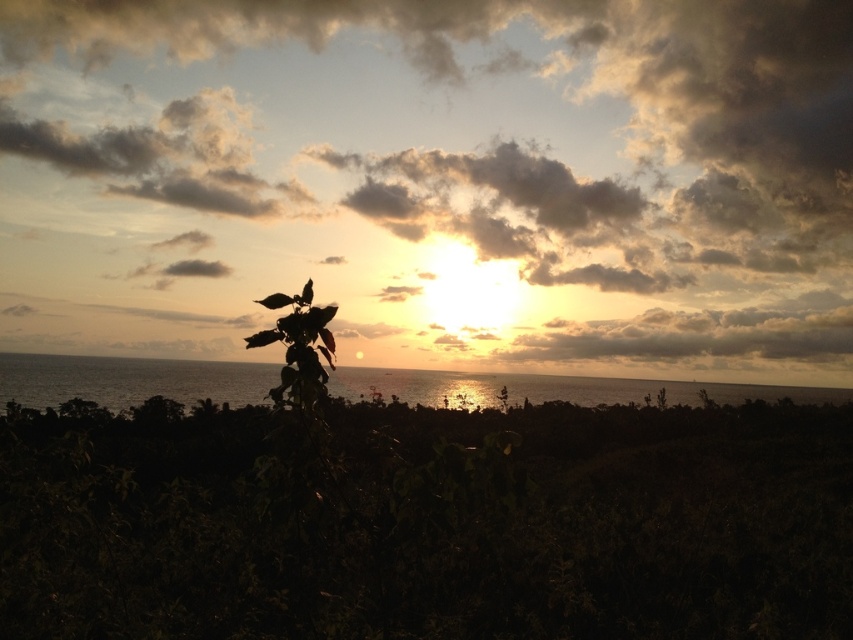
Question: Among these objects, which one is farthest from the camera?

Choices:
 (A) cloudy sky at upper center
 (B) green leafy plant at center
 (C) shiny metallic water at center

Answer: (C)

Question: Where is cloudy sky at upper center located in relation to green leafy plant at center in the image?

Choices:
 (A) above
 (B) below

Answer: (A)

Question: Can you confirm if cloudy sky at upper center is wider than green leafy plant at center-left?

Choices:
 (A) no
 (B) yes

Answer: (B)

Question: Which of the following is the closest to the observer?

Choices:
 (A) (321, 369)
 (B) (463, 172)
 (C) (563, 381)
 (D) (88, 410)

Answer: (A)

Question: Can you confirm if green leafy plant at center is positioned below shiny metallic water at center?

Choices:
 (A) yes
 (B) no

Answer: (B)

Question: Which of the following is the closest to the observer?

Choices:
 (A) (734, 384)
 (B) (83, 632)
 (C) (223, 243)
 (D) (312, 332)

Answer: (D)